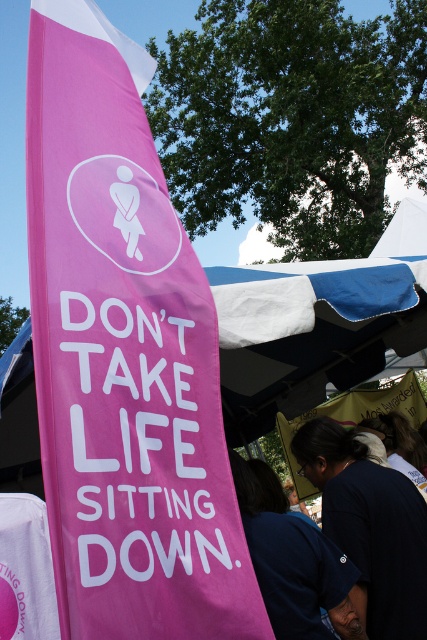
Which of these two, pink fabric banner at left or dark blue shirt at center, stands taller?

pink fabric banner at left is taller.

The image size is (427, 640). Identify the location of pink fabric banner at left. (123, 356).

Who is positioned more to the left, pink fabric banner at left or dark blue fabric at lower center?

From the viewer's perspective, pink fabric banner at left appears more on the left side.

Describe the element at coordinates (123, 356) in the screenshot. I see `pink fabric banner at left` at that location.

Where is `pink fabric banner at left`? pink fabric banner at left is located at coordinates (123, 356).

Does dark blue fabric at lower center appear over dark blue shirt at center?

No.

Which is behind, point (415, 488) or point (283, 573)?

The point (415, 488) is more distant.

At what (x,y) coordinates should I click in order to perform the action: click on dark blue fabric at lower center. Please return your answer as a coordinate pair (x, y). The image size is (427, 640). Looking at the image, I should click on (370, 528).